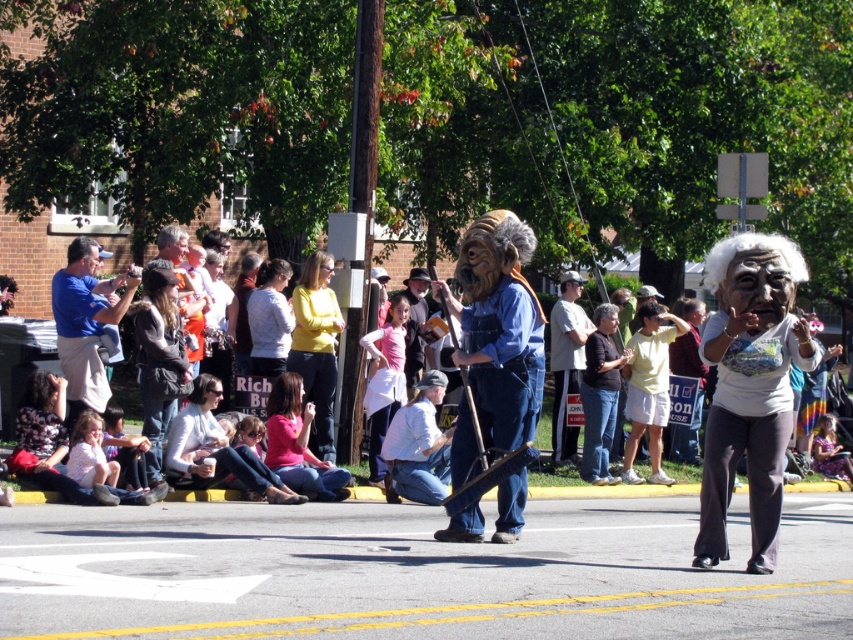
Which is behind, point (64, 282) or point (287, 348)?

Positioned behind is point (287, 348).

Can you confirm if blue fabric shirt at left is positioned to the left of light gray sweater at center?

Indeed, blue fabric shirt at left is positioned on the left side of light gray sweater at center.

Is point (132, 292) in front of point (271, 298)?

Yes, point (132, 292) is closer to viewer.

Where is `blue fabric shirt at left`? blue fabric shirt at left is located at coordinates (86, 323).

Does orange fabric bag at center have a smaller size compared to gray synthetic wig at upper left?

No, orange fabric bag at center is not smaller than gray synthetic wig at upper left.

In the scene shown: Is orange fabric bag at center above gray synthetic wig at upper left?

Actually, orange fabric bag at center is below gray synthetic wig at upper left.

The height and width of the screenshot is (640, 853). Find the location of `orange fabric bag at center`. orange fabric bag at center is located at coordinates (184, 291).

The height and width of the screenshot is (640, 853). I want to click on yellow matte shirt at center, so click(x=316, y=346).

Between point (329, 365) and point (793, 276), which one is positioned behind?

Positioned behind is point (329, 365).

This screenshot has width=853, height=640. What are the coordinates of `yellow matte shirt at center` in the screenshot? It's located at (316, 346).